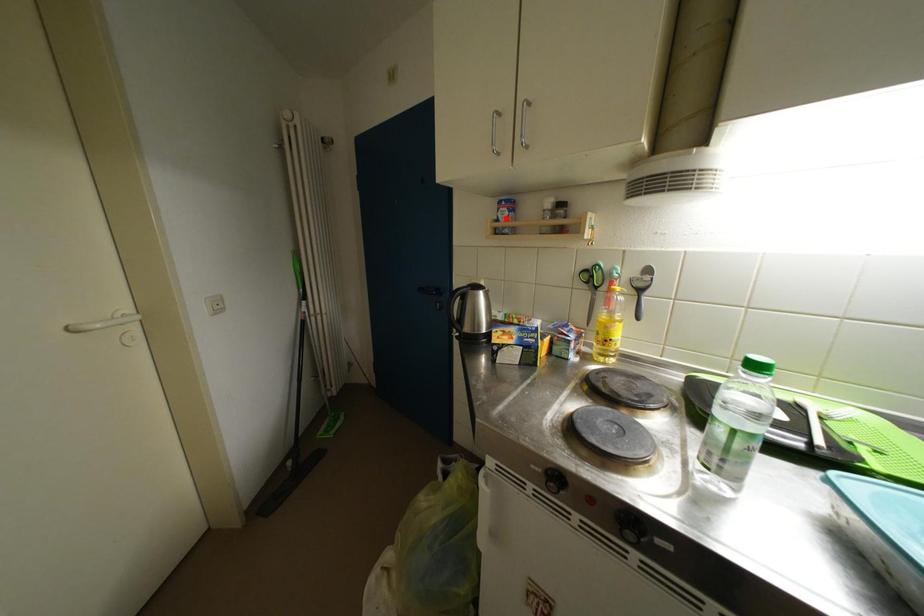
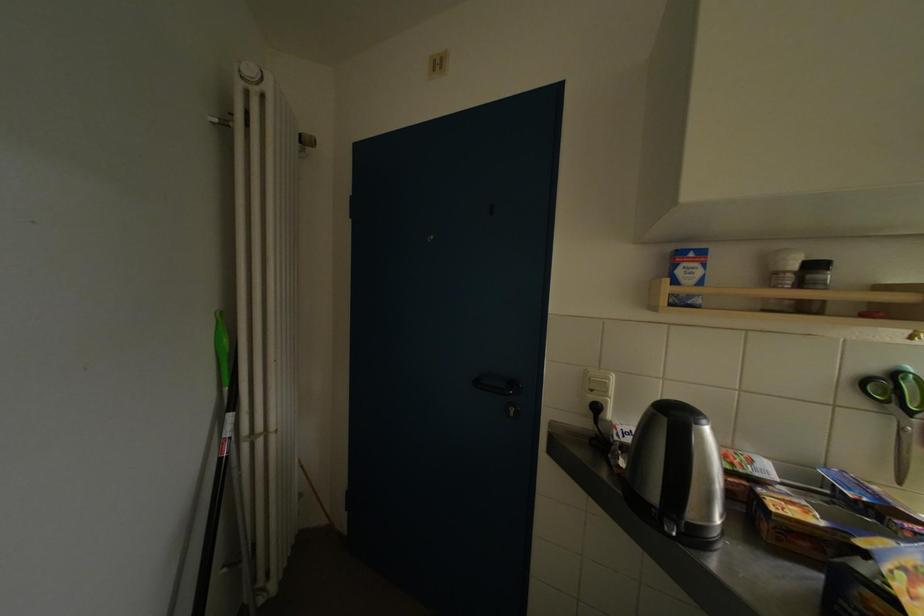
The point at the highlighted location is marked in the first image. Where is the corresponding point in the second image?

(686, 276)